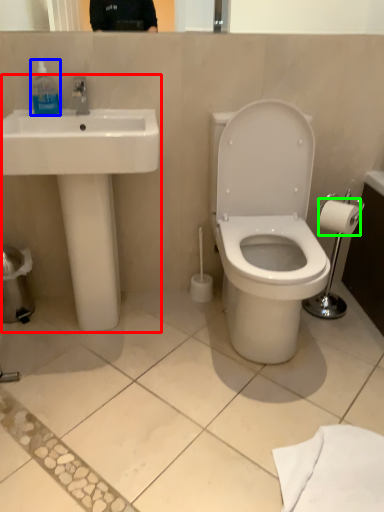
Question: Which object is the farthest from sink (highlighted by a red box)? Choose among these: toiletry (highlighted by a blue box) or toilet paper (highlighted by a green box).

Choices:
 (A) toiletry
 (B) toilet paper

Answer: (B)